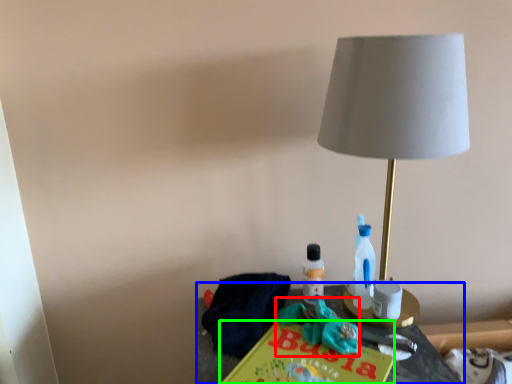
Question: Which object is positioned closest to scrub (highlighted by a red box)? Select from table (highlighted by a blue box) and paperback book (highlighted by a green box).

Choices:
 (A) table
 (B) paperback book

Answer: (B)